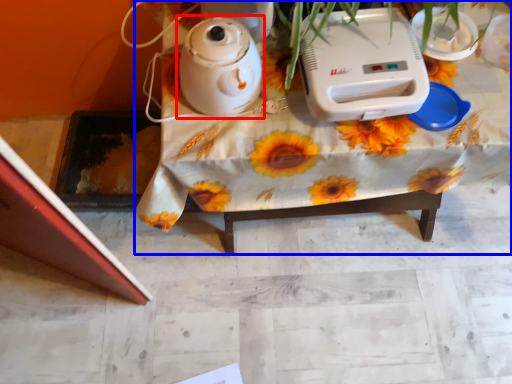
Question: Which object is further to the camera taking this photo, kettle (highlighted by a red box) or table (highlighted by a blue box)?

Choices:
 (A) kettle
 (B) table

Answer: (B)